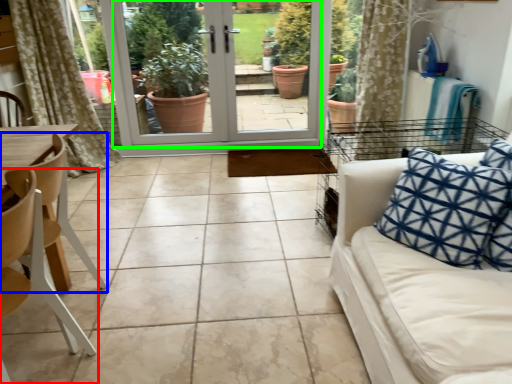
Question: Considering the real-world distances, which object is farthest from chair (highlighted by a red box)? chair (highlighted by a blue box) or screen door (highlighted by a green box)?

Choices:
 (A) chair
 (B) screen door

Answer: (B)